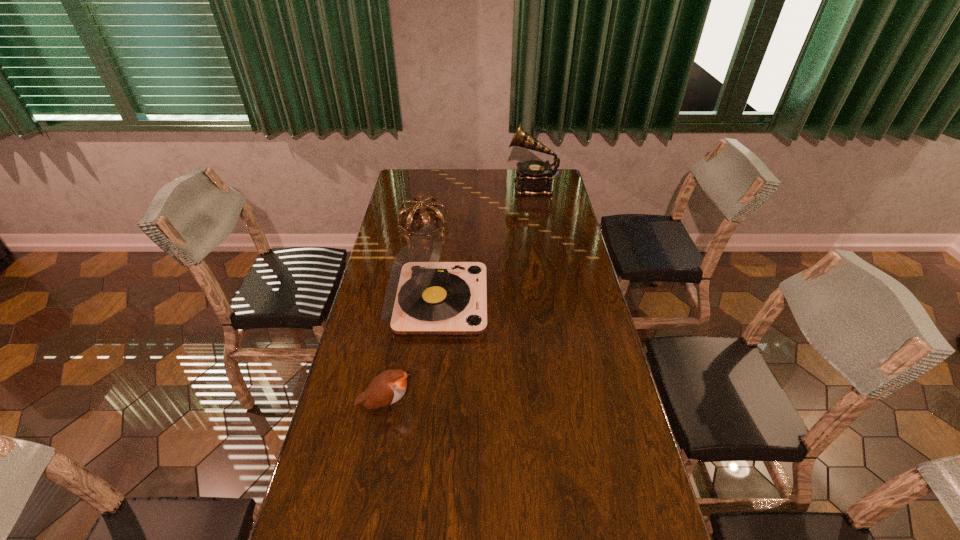
Where is `vacant space located 0.080m on the front of the tiara`? The image size is (960, 540). vacant space located 0.080m on the front of the tiara is located at coordinates (419, 251).

You are a GUI agent. You are given a task and a screenshot of the screen. Output one action in this format:
    pyautogui.click(x=<x>, y=<y>)
    Task: Click on the object that is at the far edge
    
    Given the screenshot: What is the action you would take?
    pyautogui.click(x=534, y=178)

Image resolution: width=960 pixels, height=540 pixels. Identify the location of record player at the left edge. 423,296.

Where is `bird at the left edge`? bird at the left edge is located at coordinates (387, 388).

Locate an element on the screen. tiara at the left edge is located at coordinates (417, 205).

Where is `object located in the right edge section of the desktop`? The width and height of the screenshot is (960, 540). object located in the right edge section of the desktop is located at coordinates (534, 178).

Locate an element on the screen. The height and width of the screenshot is (540, 960). object situated at the far right corner is located at coordinates (534, 178).

I want to click on free point at the far edge, so click(469, 191).

I want to click on free location at the left edge of the desktop, so click(384, 435).

The height and width of the screenshot is (540, 960). I want to click on vacant space at the right edge of the desktop, so click(x=656, y=528).